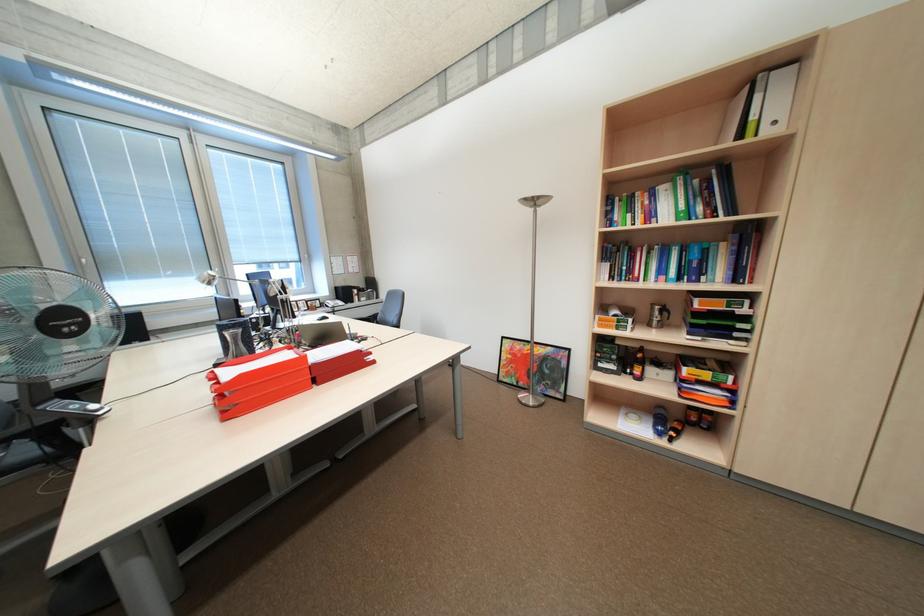
You are a GUI agent. You are given a task and a screenshot of the screen. Output one action in this format:
    pyautogui.click(x=<x>, y=<y>)
    Task: Click on the red file organizer
    The width and height of the screenshot is (924, 616).
    Given the screenshot: What is the action you would take?
    pyautogui.click(x=261, y=387)